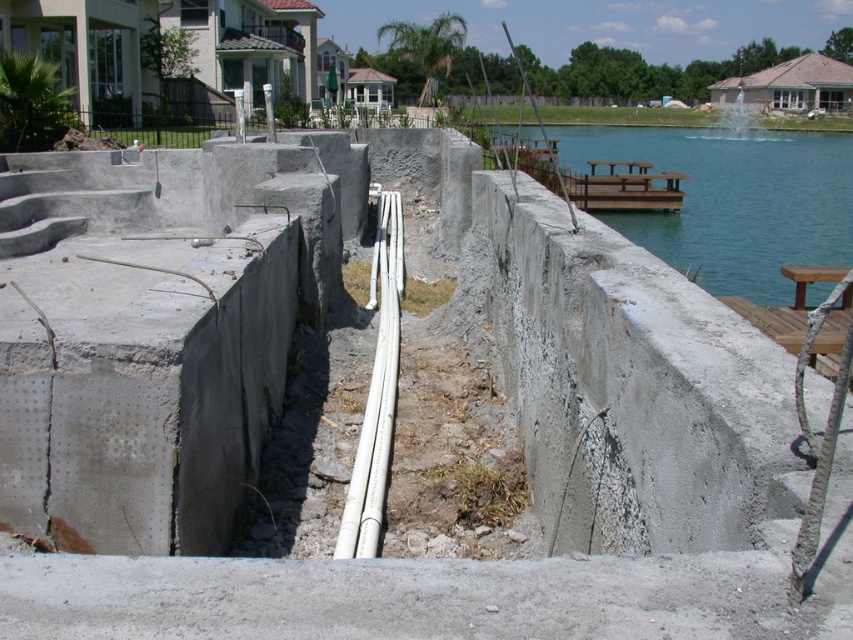
You are a construction worker who needs to locate the white plastic pipes at center. From the blue water at upper right, which direction should you move to find them?

The blue water at upper right is to the right of the white plastic pipes at center, so you should move to the left to find the white plastic pipes at center.

You are a construction worker who needs to ensure safety around the blue water at upper right and white plastic pipes at center. Based on their positions, which object is located higher in the image?

The blue water at upper right is above the white plastic pipes at center, so it is higher in the image.

You are a construction inspector checking the site. You notice the blue water at upper right and the white plastic pipes at center. Based on their positions, which one is more likely to be in a location that requires immediate safety precautions due to potential flooding risks?

The blue water at upper right might be wider than white plastic pipes at center, so it is more likely to be in a location requiring immediate safety precautions due to potential flooding risks.